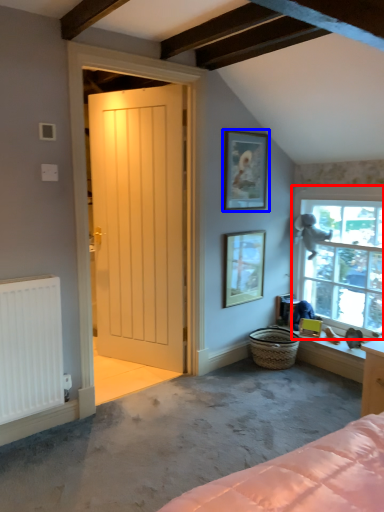
Question: Among these objects, which one is farthest to the camera, window (highlighted by a red box) or picture frame (highlighted by a blue box)?

Choices:
 (A) window
 (B) picture frame

Answer: (B)